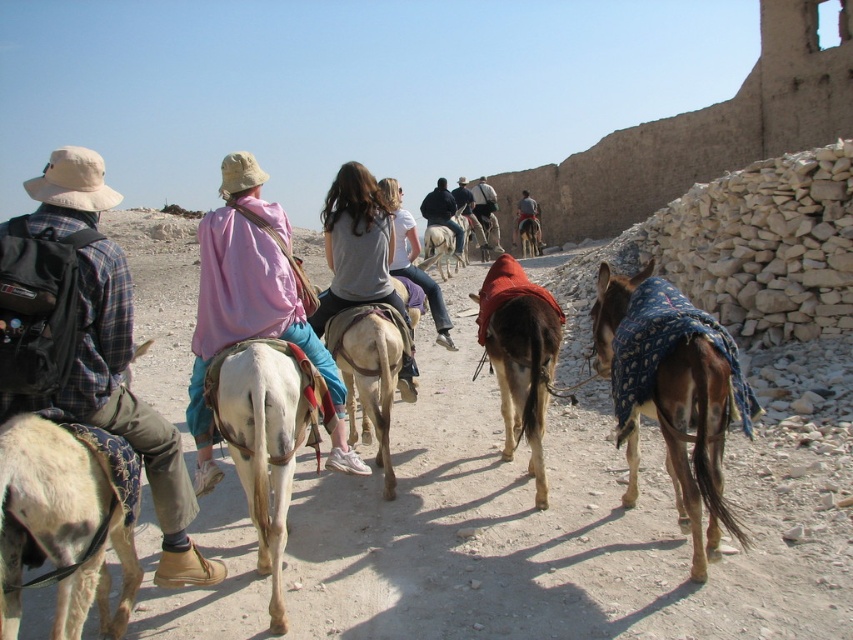
Question: Does pink fabric jacket at center appear on the right side of light brown leather jacket at center?

Choices:
 (A) no
 (B) yes

Answer: (A)

Question: Which point appears closest to the camera in this image?

Choices:
 (A) (281, 556)
 (B) (515, 227)
 (C) (306, 291)

Answer: (A)

Question: Is light gray cotton shirt at center bigger than blue denim jeans at center?

Choices:
 (A) yes
 (B) no

Answer: (B)

Question: Does light brown fabric-covered donkey at center have a smaller size compared to light gray fabric jacket at center?

Choices:
 (A) yes
 (B) no

Answer: (A)

Question: Estimate the real-world distances between objects in this image. Which object is closer to the dark blue jacket at center?

Choices:
 (A) blue patterned blanket at right
 (B) light brown leather jacket at center
 (C) white cloth-covered donkey at lower left
 (D) pink fabric jacket at center

Answer: (B)

Question: Which point is farther from the camera taking this photo?

Choices:
 (A) (401, 212)
 (B) (494, 262)
 (C) (73, 458)
 (D) (345, 253)

Answer: (A)